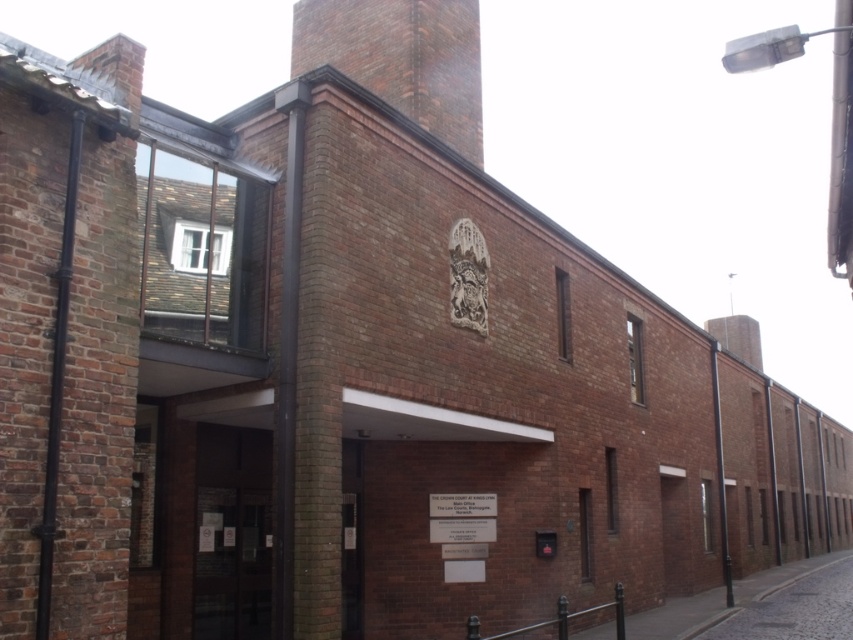
You are a delivery person trying to find the entrance to the brick building. You see a transparent glass door at center and a cobblestone street at lower right. Which object is located to the left of the other?

The transparent glass door at center is positioned on the left side of cobblestone street at lower right, so the transparent glass door at center is to the left of the cobblestone street at lower right.

You are a delivery person trying to enter the building through the transparent glass door at center. You notice a cobblestone street at lower right nearby. Which object is closer to the entrance of the building?

The transparent glass door at center is closer to the entrance of the building than the cobblestone street at lower right because the door is part of the building structure, while the street is located further out at the lower right corner.